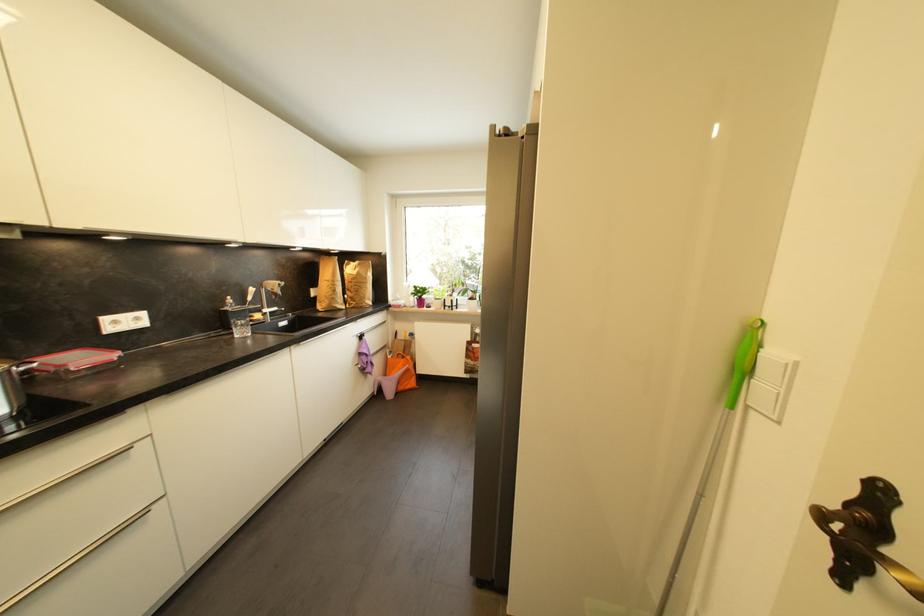
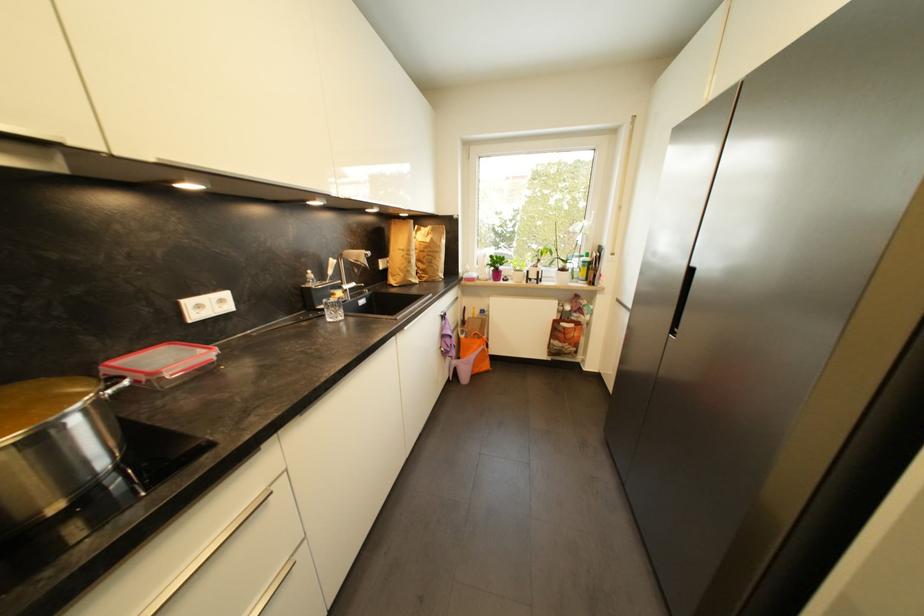
In the second image, find the point that corresponds to the point at 247,334 in the first image.

(339, 317)